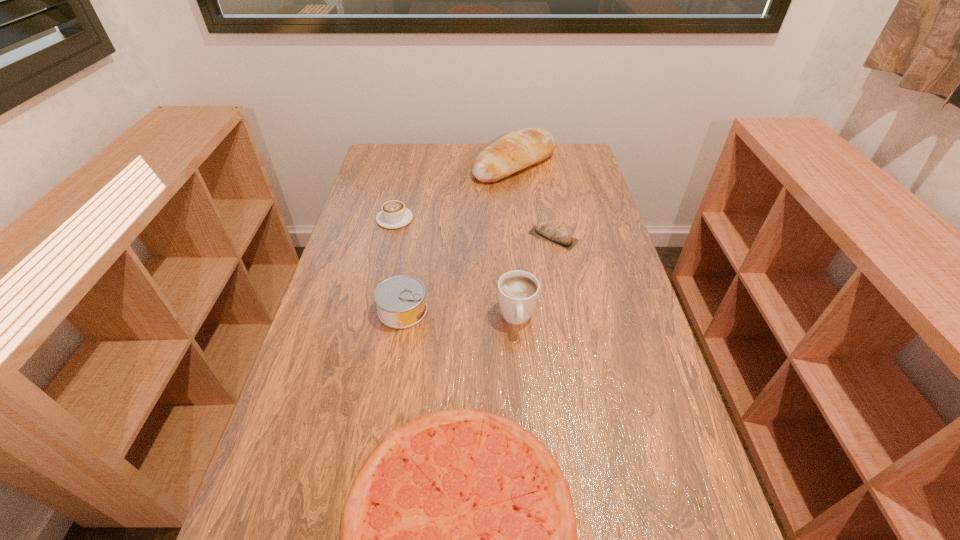
What are the coordinates of `vacant space that is in between the left cappuccino and the second shortest object` in the screenshot? It's located at (474, 228).

Identify the location of object that can be found as the third closest to the can. (393, 214).

Identify the location of object that is the fifth nearest to the farthest object. The width and height of the screenshot is (960, 540). (458, 539).

The image size is (960, 540). I want to click on vacant point that satisfies the following two spatial constraints: 1. with the handle on the right side of the farther cappuccino; 2. on the left side of the bread, so click(x=407, y=164).